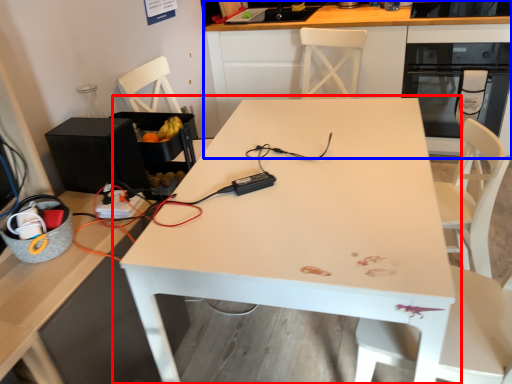
Question: Which point is closer to the camera, table (highlighted by a red box) or cabinetry (highlighted by a blue box)?

Choices:
 (A) table
 (B) cabinetry

Answer: (A)